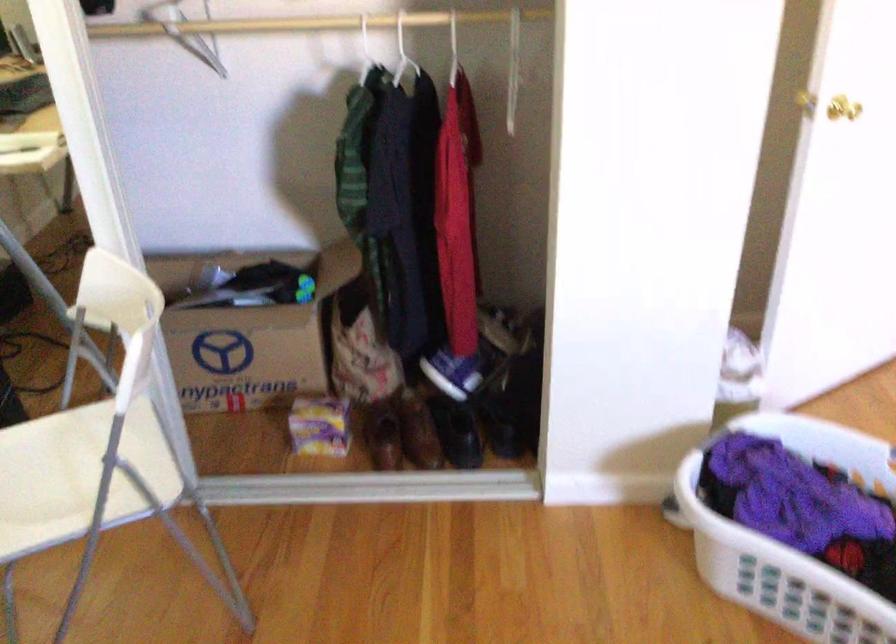
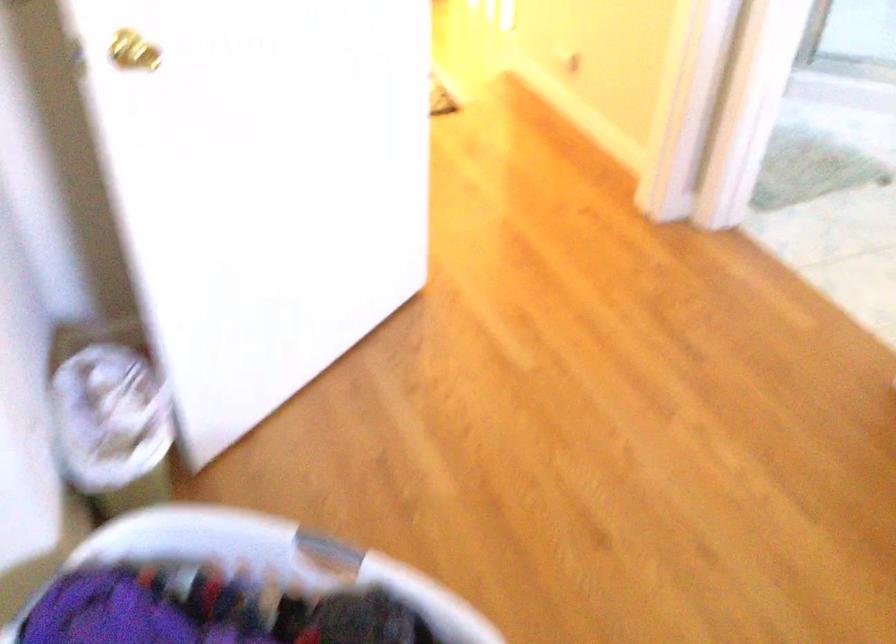
Which direction would the cameraman need to move to produce the second image?

The movement direction of the cameraman is right, forward.